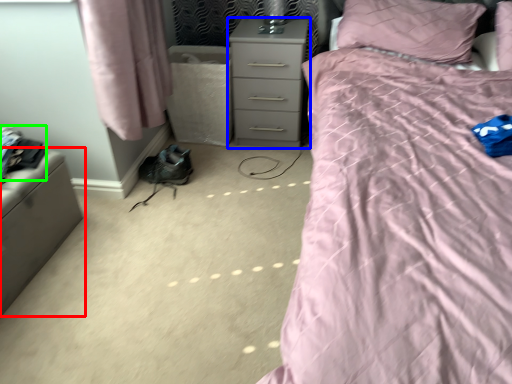
Question: Which object is positioned closest to furniture (highlighted by a red box)? Select from nightstand (highlighted by a blue box) and clothing (highlighted by a green box).

Choices:
 (A) nightstand
 (B) clothing

Answer: (B)